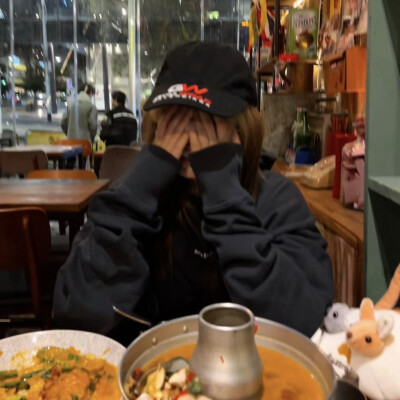
Locate an element on the screen. This screenshot has height=400, width=400. window is located at coordinates (117, 47).